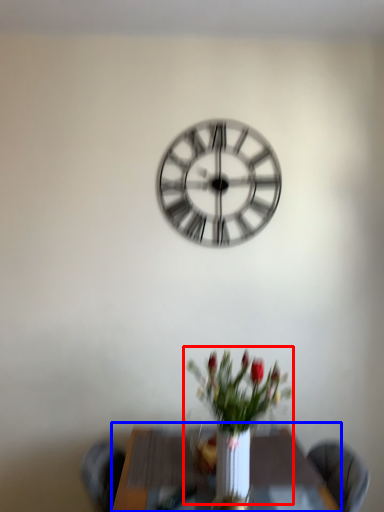
Question: Which of the following is the closest to the observer, floral arrangement (highlighted by a red box) or table (highlighted by a blue box)?

Choices:
 (A) floral arrangement
 (B) table

Answer: (A)